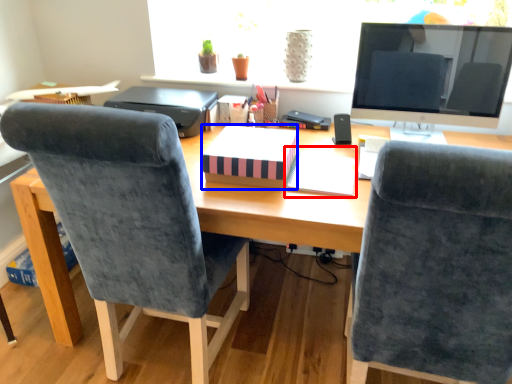
Question: Among these objects, which one is nearest to the camera, notebook (highlighted by a red box) or notebook (highlighted by a blue box)?

Choices:
 (A) notebook
 (B) notebook

Answer: (B)